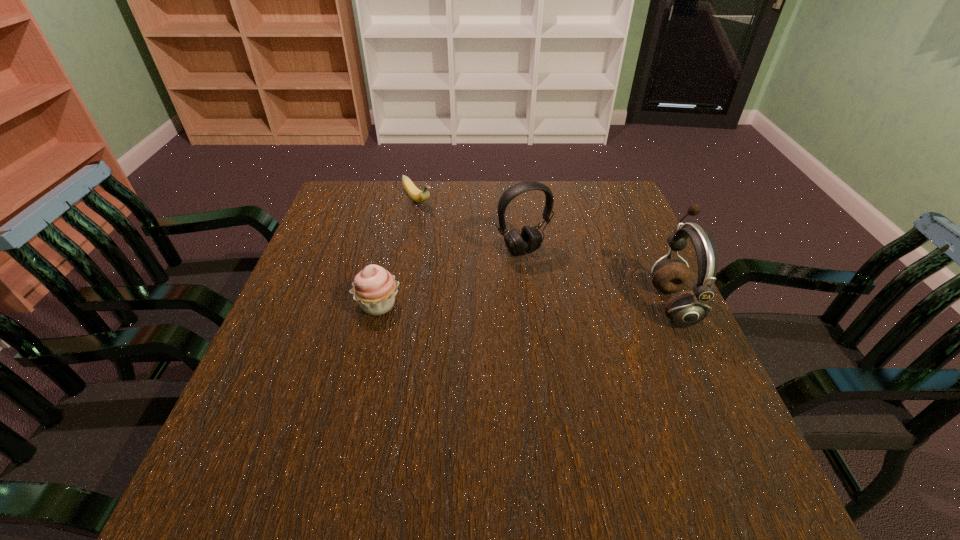
The height and width of the screenshot is (540, 960). Identify the location of free space on the desktop that is between the third tallest object and the rightmost object and is positioned on the front-facing side of the headset. (561, 305).

Identify the location of vacant space on the desktop that is between the cupcake and the rightmost object and is positioned at the stem of the banana. pos(524,305).